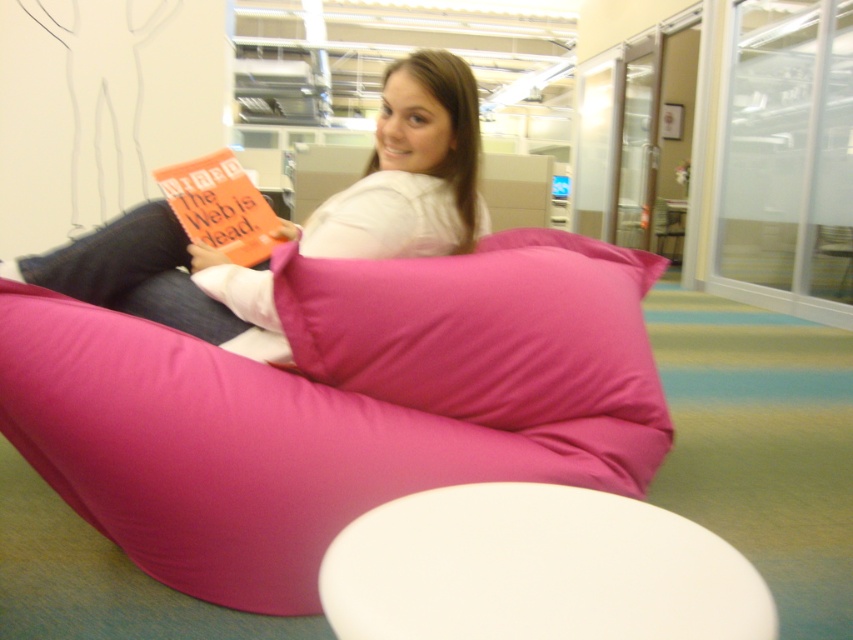
You are designing a seating area and need to place both the fuchsia fabric bean bag at center and the matte pink bean bag at center side by side. Given their sizes, which bean bag will require more floor space?

The fuchsia fabric bean bag at center requires more floor space because its width is larger than the matte pink bean bag at center.

You are organizing a photo shoot and need to place two bean bags in the scene. The scene has a fuchsia fabric bean bag at center and a matte pink bean bag at center. According to the image, which bean bag is positioned to the right of the other?

The fuchsia fabric bean bag at center is to the right of the matte pink bean bag at center.